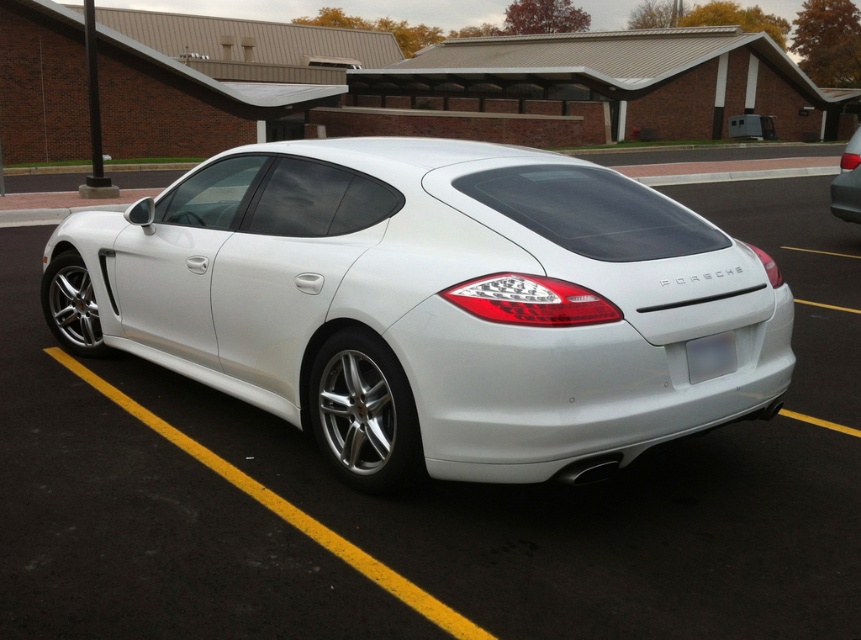
Question: Which of the following is the closest to the observer?

Choices:
 (A) (840, 188)
 (B) (695, 381)
 (C) (669, 392)

Answer: (C)

Question: Can you confirm if white plastic license plate at rear is positioned to the left of white glossy car at right?

Choices:
 (A) no
 (B) yes

Answer: (B)

Question: Which object is the closest to the white metallic car at center?

Choices:
 (A) white glossy car at right
 (B) white plastic license plate at rear

Answer: (B)

Question: Which point is closer to the camera?

Choices:
 (A) white plastic license plate at rear
 (B) white glossy car at right
 (C) white metallic car at center

Answer: (C)

Question: Considering the relative positions of white plastic license plate at rear and white glossy car at right in the image provided, where is white plastic license plate at rear located with respect to white glossy car at right?

Choices:
 (A) left
 (B) right

Answer: (A)

Question: Does white plastic license plate at rear appear under white glossy car at right?

Choices:
 (A) yes
 (B) no

Answer: (A)